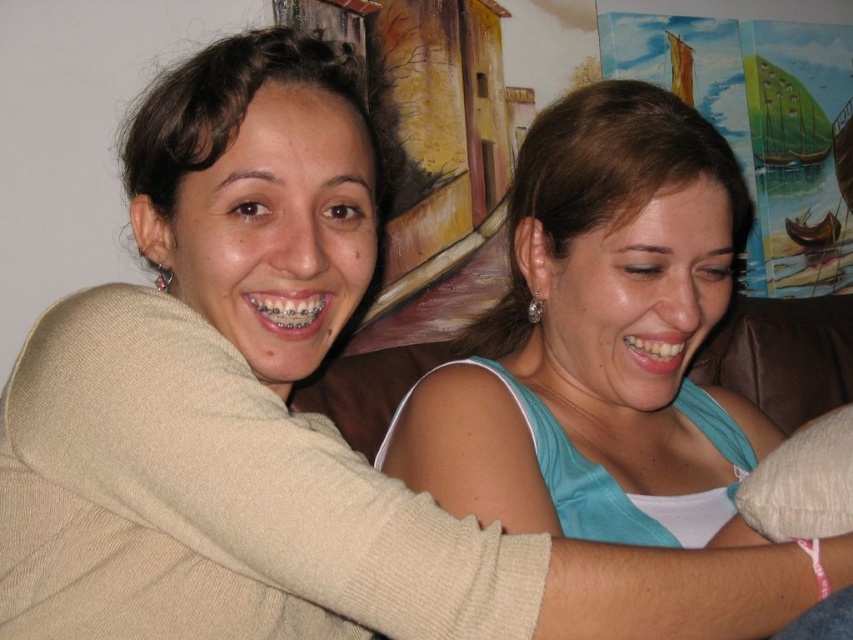
You are an orthodontist examining the image. You need to locate the metallic braces at center. Where exactly are they positioned in the image?

The metallic braces at center are located at point coordinates of 0.486 on the x axis and 0.340 on the y axis.

You are a dentist examining the image. You notice the metallic braces at center and the white glossy teeth at center. Which object is smaller in size?

The metallic braces at center is smaller in size compared to the white glossy teeth at center.

You are designing a living room layout and want to place the beige fabric pillow at lower right and the white glossy teeth at center on a shelf. The shelf has a width of 1 meter. Can both items fit side by side without overlapping?

The beige fabric pillow at lower right is wider than the white glossy teeth at center. Since the shelf is 1 meter wide, both items can fit side by side as long as their combined widths do not exceed 1 meter. However, without knowing the exact dimensions of each item, it is impossible to determine if they will fit perfectly.